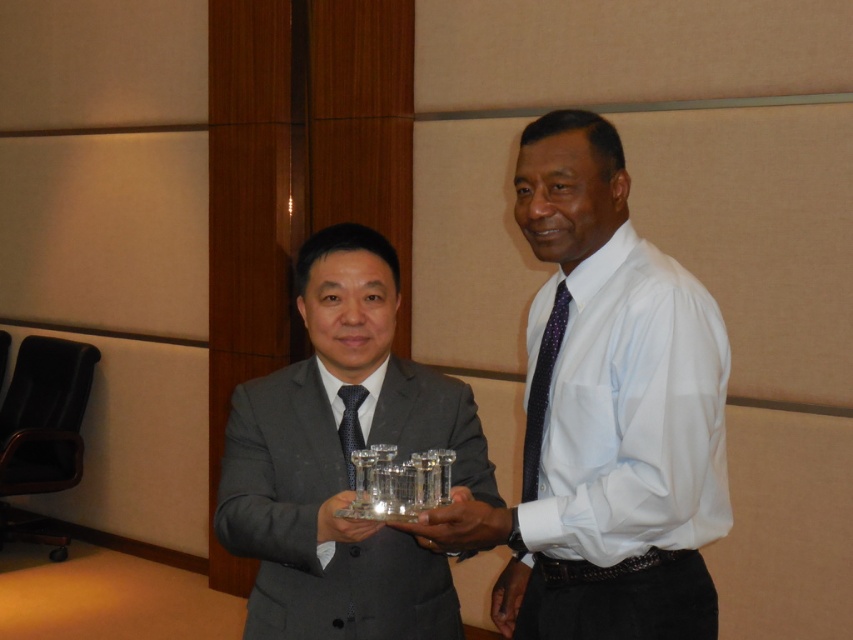
Can you confirm if white glossy shirt at center is taller than dark blue textured tie at center?

Indeed, white glossy shirt at center has a greater height compared to dark blue textured tie at center.

Between point (558, 608) and point (357, 424), which one is positioned behind?

The point (558, 608) is more distant.

Where is `white glossy shirt at center`? Image resolution: width=853 pixels, height=640 pixels. white glossy shirt at center is located at coordinates tap(605, 416).

Can you confirm if white glossy shirt at center is positioned to the left of matte black suit at center?

No, white glossy shirt at center is not to the left of matte black suit at center.

Based on the photo, who is positioned more to the left, white glossy shirt at center or matte black suit at center?

matte black suit at center is more to the left.

Is point (561, 541) in front of point (311, 604)?

Yes, point (561, 541) is closer to viewer.

At what (x,y) coordinates should I click in order to perform the action: click on white glossy shirt at center. Please return your answer as a coordinate pair (x, y). This screenshot has width=853, height=640. Looking at the image, I should click on (605, 416).

The width and height of the screenshot is (853, 640). What do you see at coordinates (341, 461) in the screenshot?
I see `matte black suit at center` at bounding box center [341, 461].

Who is shorter, matte black suit at center or purple dotted fabric tie at right?

purple dotted fabric tie at right

Describe the element at coordinates (341, 461) in the screenshot. I see `matte black suit at center` at that location.

You are a GUI agent. You are given a task and a screenshot of the screen. Output one action in this format:
    pyautogui.click(x=<x>, y=<y>)
    Task: Click on the matte black suit at center
    
    Given the screenshot: What is the action you would take?
    pyautogui.click(x=341, y=461)